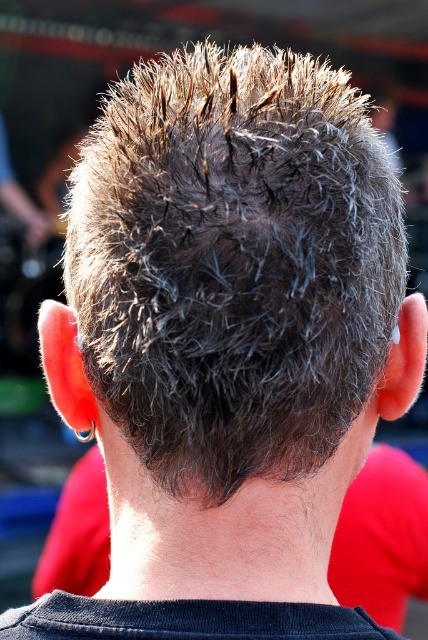
Based on the photo, does dark brown spiky hair at center appear over dark gray hair at center?

Indeed, dark brown spiky hair at center is positioned over dark gray hair at center.

How much distance is there between dark brown spiky hair at center and dark gray hair at center?

They are 2.25 meters apart.

At what (x,y) coordinates should I click in order to perform the action: click on dark brown spiky hair at center. Please return your answer as a coordinate pair (x, y). The width and height of the screenshot is (428, 640). Looking at the image, I should click on (234, 262).